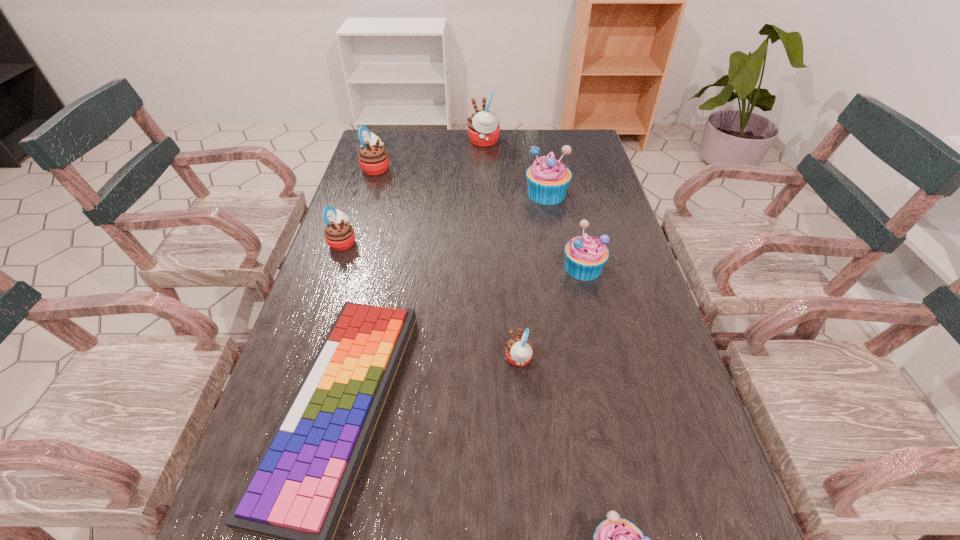
This screenshot has height=540, width=960. Identify the location of free region that satisfies the following two spatial constraints: 1. on the front-facing side of the tallest object; 2. on the left side of the sixth nearest object. (484, 193).

Identify the location of free space that satisfies the following two spatial constraints: 1. on the front-facing side of the fourth nearest object; 2. on the left side of the third nearest pink muffin. (345, 267).